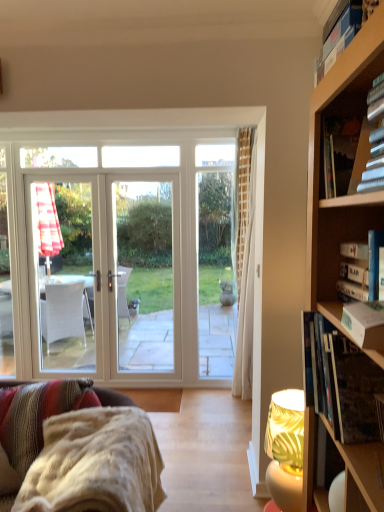
Find the location of a particular element. The width and height of the screenshot is (384, 512). hardcover book at upper right, which appears as the 4th book when ordered from the bottom is located at coordinates (344, 154).

This screenshot has width=384, height=512. What do you see at coordinates (362, 270) in the screenshot?
I see `hardcover book at right, marked as the third book in a top-to-bottom arrangement` at bounding box center [362, 270].

What do you see at coordinates (95, 464) in the screenshot?
I see `white textured fabric couch at lower left` at bounding box center [95, 464].

Identify the location of hardcover book at upper right, marked as the 2th book in a top-to-bottom arrangement. The image size is (384, 512). (344, 154).

Is white textured fabric couch at lower left further to the viewer compared to hardcover book at upper right, which ranks as the first book in top-to-bottom order?

Yes, white textured fabric couch at lower left is further from the viewer.

Consider the image. Is white textured fabric couch at lower left inside or outside of hardcover book at upper right, arranged as the fifth book when ordered from the bottom?

white textured fabric couch at lower left is not inside hardcover book at upper right, arranged as the fifth book when ordered from the bottom, it's outside.

From the image's perspective, which one is positioned lower, white textured fabric couch at lower left or hardcover book at upper right, which ranks as the first book in top-to-bottom order?

white textured fabric couch at lower left is shown below in the image.

Is point (104, 472) closer to camera compared to point (336, 55)?

No.

Consider the image. Are hardcover book at upper right, marked as the 2th book in a top-to-bottom arrangement, and hardcover book at right, placed as the 1th book when sorted from bottom to top, far apart?

hardcover book at upper right, marked as the 2th book in a top-to-bottom arrangement, is actually quite close to hardcover book at right, placed as the 1th book when sorted from bottom to top.

Is hardcover book at upper right, marked as the 2th book in a top-to-bottom arrangement, situated inside hardcover book at right, which is the 5th book in top-to-bottom order, or outside?

hardcover book at upper right, marked as the 2th book in a top-to-bottom arrangement, is located beyond the bounds of hardcover book at right, which is the 5th book in top-to-bottom order.

Who is taller, hardcover book at upper right, marked as the 2th book in a top-to-bottom arrangement, or hardcover book at right, which is the 5th book in top-to-bottom order?

Standing taller between the two is hardcover book at upper right, marked as the 2th book in a top-to-bottom arrangement.

The height and width of the screenshot is (512, 384). Find the location of `the 1st book counting from the left of the hardcover book at upper right, which appears as the 4th book when ordered from the bottom`. the 1st book counting from the left of the hardcover book at upper right, which appears as the 4th book when ordered from the bottom is located at coordinates [x=340, y=381].

Considering the points (373, 371) and (371, 336), which point is behind, point (373, 371) or point (371, 336)?

The point (373, 371) is farther from the camera.

Can you confirm if hardcover book at right, which is the 5th book in top-to-bottom order, is positioned to the right of white paper book at right, which ranks as the 2th book in bottom-to-top order?

Yes, hardcover book at right, which is the 5th book in top-to-bottom order, is to the right of white paper book at right, which ranks as the 2th book in bottom-to-top order.

Which is in front, hardcover book at right, which is the 5th book in top-to-bottom order, or white paper book at right, the 4th book in the top-to-bottom sequence?

white paper book at right, the 4th book in the top-to-bottom sequence.

Based on the photo, can you tell me how much hardcover book at right, which is the 5th book in top-to-bottom order, and white paper book at right, the 4th book in the top-to-bottom sequence, differ in facing direction?

There is a 3.47-degree angle between the facing directions of hardcover book at right, which is the 5th book in top-to-bottom order, and white paper book at right, the 4th book in the top-to-bottom sequence.

From the image's perspective, which one is positioned lower, green leaf-patterned fabric lampshade at lower right or hardcover book at upper right, which appears as the 4th book when ordered from the bottom?

green leaf-patterned fabric lampshade at lower right appears lower in the image.

Are green leaf-patterned fabric lampshade at lower right and hardcover book at upper right, marked as the 2th book in a top-to-bottom arrangement, far apart?

Yes, green leaf-patterned fabric lampshade at lower right is far from hardcover book at upper right, marked as the 2th book in a top-to-bottom arrangement.

Who is smaller, green leaf-patterned fabric lampshade at lower right or hardcover book at upper right, marked as the 2th book in a top-to-bottom arrangement?

hardcover book at upper right, marked as the 2th book in a top-to-bottom arrangement.

Is green leaf-patterned fabric lampshade at lower right positioned with its back to hardcover book at upper right, which appears as the 4th book when ordered from the bottom?

No, hardcover book at upper right, which appears as the 4th book when ordered from the bottom, is not at the back of green leaf-patterned fabric lampshade at lower right.

From a real-world perspective, count 2nd books downward from the hardcover book at right, the 3th book in the bottom-to-top sequence, and point to it. Please provide its 2D coordinates.

[(340, 381)]

Consider the image. From the image's perspective, would you say hardcover book at right, the 3th book in the bottom-to-top sequence, is shown under hardcover book at right, placed as the 1th book when sorted from bottom to top?

Incorrect, from the image's perspective, hardcover book at right, the 3th book in the bottom-to-top sequence, is higher than hardcover book at right, placed as the 1th book when sorted from bottom to top.

Is hardcover book at right, marked as the third book in a top-to-bottom arrangement, bigger or smaller than hardcover book at right, placed as the 1th book when sorted from bottom to top?

Considering their sizes, hardcover book at right, marked as the third book in a top-to-bottom arrangement, takes up less space than hardcover book at right, placed as the 1th book when sorted from bottom to top.

Does hardcover book at right, the 3th book in the bottom-to-top sequence, come in front of hardcover book at right, placed as the 1th book when sorted from bottom to top?

No, the depth of hardcover book at right, the 3th book in the bottom-to-top sequence, is greater than that of hardcover book at right, placed as the 1th book when sorted from bottom to top.

Consider the image. Is white paper book at right, which ranks as the 2th book in bottom-to-top order, aimed at green leaf-patterned fabric lampshade at lower right?

No, white paper book at right, which ranks as the 2th book in bottom-to-top order, is not aimed at green leaf-patterned fabric lampshade at lower right.

Which is less distant, (355, 323) or (282, 476)?

Point (355, 323) appears to be closer to the viewer than point (282, 476).

Considering the sizes of objects white paper book at right, the 4th book in the top-to-bottom sequence, and green leaf-patterned fabric lampshade at lower right in the image provided, who is smaller, white paper book at right, the 4th book in the top-to-bottom sequence, or green leaf-patterned fabric lampshade at lower right?

With smaller size is white paper book at right, the 4th book in the top-to-bottom sequence.

Is white paper book at right, which ranks as the 2th book in bottom-to-top order, inside the boundaries of green leaf-patterned fabric lampshade at lower right, or outside?

The correct answer is: outside.

Is hardcover book at right, the 3th book in the bottom-to-top sequence, smaller than hardcover book at upper right, arranged as the fifth book when ordered from the bottom?

Yes.

From a real-world perspective, is hardcover book at right, the 3th book in the bottom-to-top sequence, located beneath hardcover book at upper right, which ranks as the first book in top-to-bottom order?

Correct, in the physical world, hardcover book at right, the 3th book in the bottom-to-top sequence, is lower than hardcover book at upper right, which ranks as the first book in top-to-bottom order.

From the image's perspective, between hardcover book at right, marked as the third book in a top-to-bottom arrangement, and hardcover book at upper right, which ranks as the first book in top-to-bottom order, who is located below?

hardcover book at right, marked as the third book in a top-to-bottom arrangement, is shown below in the image.

From the image's perspective, which book is the 5th one above the white textured fabric couch at lower left? Please provide its 2D coordinates.

[(338, 34)]

From the image's perspective, count 3rd books downward from the hardcover book at upper right, marked as the 2th book in a top-to-bottom arrangement, and point to it. Please provide its 2D coordinates.

[(340, 381)]

Consider the image. Estimate the real-world distances between objects in this image. Which object is closer to hardcover book at upper right, which ranks as the first book in top-to-bottom order, hardcover book at right, marked as the third book in a top-to-bottom arrangement, or hardcover book at right, placed as the 1th book when sorted from bottom to top?

hardcover book at right, marked as the third book in a top-to-bottom arrangement, is closer to hardcover book at upper right, which ranks as the first book in top-to-bottom order.

Which object lies further to the anchor point hardcover book at upper right, arranged as the fifth book when ordered from the bottom, white textured fabric couch at lower left or hardcover book at right, placed as the 1th book when sorted from bottom to top?

white textured fabric couch at lower left lies further to hardcover book at upper right, arranged as the fifth book when ordered from the bottom, than the other object.

When comparing their distances from green leaf-patterned fabric lampshade at lower right, does hardcover book at right, placed as the 1th book when sorted from bottom to top, or hardcover book at upper right, which ranks as the first book in top-to-bottom order, seem closer?

hardcover book at right, placed as the 1th book when sorted from bottom to top, lies closer to green leaf-patterned fabric lampshade at lower right than the other object.

Considering their positions, is hardcover book at right, placed as the 1th book when sorted from bottom to top, positioned further to white textured fabric couch at lower left than hardcover book at right, marked as the third book in a top-to-bottom arrangement?

The object further to white textured fabric couch at lower left is hardcover book at right, marked as the third book in a top-to-bottom arrangement.

When comparing their distances from hardcover book at right, which is the 5th book in top-to-bottom order, does white paper book at right, which ranks as the 2th book in bottom-to-top order, or hardcover book at upper right, arranged as the fifth book when ordered from the bottom, seem closer?

white paper book at right, which ranks as the 2th book in bottom-to-top order.

Looking at the image, which one is located further to green leaf-patterned fabric lampshade at lower right, hardcover book at upper right, marked as the 2th book in a top-to-bottom arrangement, or white paper book at right, the 4th book in the top-to-bottom sequence?

hardcover book at upper right, marked as the 2th book in a top-to-bottom arrangement, lies further to green leaf-patterned fabric lampshade at lower right than the other object.

From the image, which object appears to be nearer to hardcover book at upper right, which ranks as the first book in top-to-bottom order, hardcover book at right, marked as the third book in a top-to-bottom arrangement, or hardcover book at upper right, marked as the 2th book in a top-to-bottom arrangement?

Among the two, hardcover book at upper right, marked as the 2th book in a top-to-bottom arrangement, is located nearer to hardcover book at upper right, which ranks as the first book in top-to-bottom order.

Looking at the image, which one is located further to hardcover book at right, the 3th book in the bottom-to-top sequence, white paper book at right, which ranks as the 2th book in bottom-to-top order, or hardcover book at upper right, which appears as the 4th book when ordered from the bottom?

hardcover book at upper right, which appears as the 4th book when ordered from the bottom.

You are a GUI agent. You are given a task and a screenshot of the screen. Output one action in this format:
    pyautogui.click(x=<x>, y=<y>)
    Task: Click on the book between hardcover book at upper right, marked as the 2th book in a top-to-bottom arrangement, and white paper book at right, which ranks as the 2th book in bottom-to-top order, vertically
    This screenshot has width=384, height=512.
    Given the screenshot: What is the action you would take?
    362,270

Locate an element on the screen. The width and height of the screenshot is (384, 512). lamp between white textured fabric couch at lower left and hardcover book at right, the 3th book in the bottom-to-top sequence, from left to right is located at coordinates (285, 449).

Where is `lamp between white textured fabric couch at lower left and hardcover book at right, which is the 5th book in top-to-bottom order, in the horizontal direction`? The width and height of the screenshot is (384, 512). lamp between white textured fabric couch at lower left and hardcover book at right, which is the 5th book in top-to-bottom order, in the horizontal direction is located at coordinates (285, 449).

This screenshot has height=512, width=384. Find the location of `lamp between hardcover book at upper right, which ranks as the first book in top-to-bottom order, and white textured fabric couch at lower left, in the vertical direction`. lamp between hardcover book at upper right, which ranks as the first book in top-to-bottom order, and white textured fabric couch at lower left, in the vertical direction is located at coordinates (285, 449).